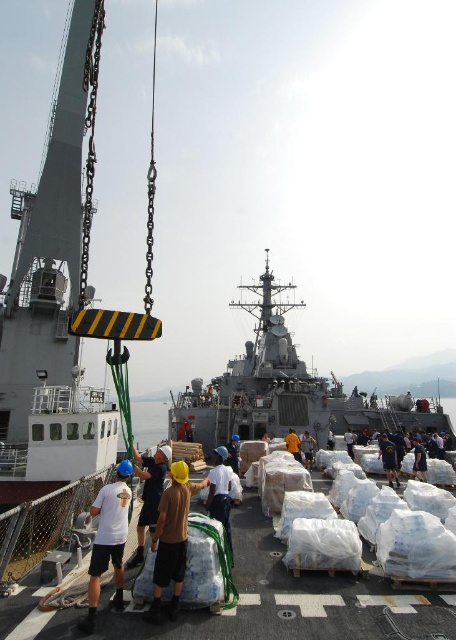
Question: Which point appears farthest from the camera in this image?

Choices:
 (A) (172, 595)
 (B) (186, 438)

Answer: (B)

Question: Does white cotton t-shirt at center appear over white matte shirt at center?

Choices:
 (A) yes
 (B) no

Answer: (A)

Question: Among these points, which one is farthest from the camera?

Choices:
 (A) (123, 474)
 (B) (265, 435)

Answer: (B)

Question: Is gray metallic ship at center below brown fabric shirt at center?

Choices:
 (A) yes
 (B) no

Answer: (B)

Question: Does gray metallic ship at center have a lesser width compared to white matte shirt at center?

Choices:
 (A) yes
 (B) no

Answer: (B)

Question: Which object appears closest to the camera in this image?

Choices:
 (A) white cotton t-shirt at center
 (B) white matte shirt at center
 (C) gray metallic ship at center

Answer: (A)